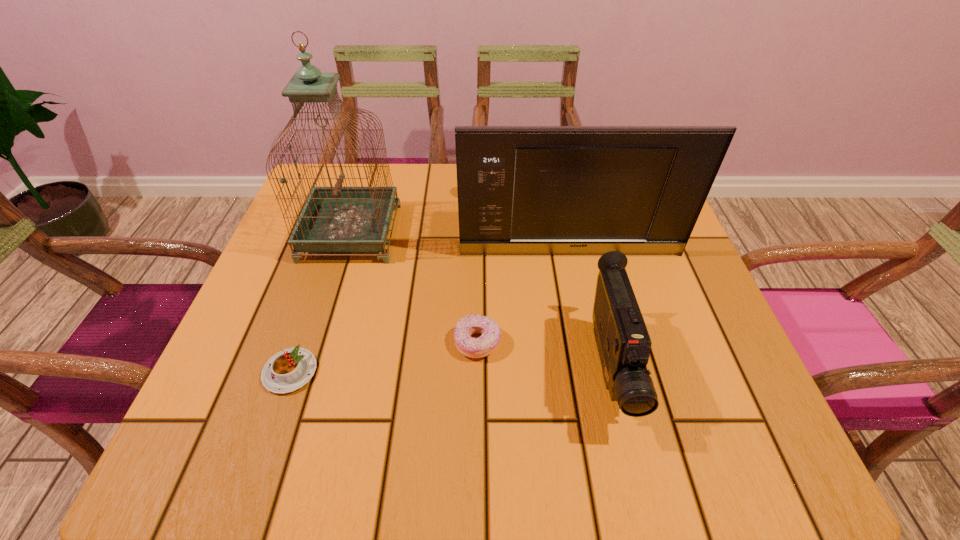
Find the location of a particular element. This screenshot has height=540, width=960. birdcage is located at coordinates (334, 219).

Identify the location of the second tallest object. (542, 190).

Where is `camcorder`? The image size is (960, 540). camcorder is located at coordinates (623, 342).

The image size is (960, 540). Find the location of `the second shortest object`. the second shortest object is located at coordinates (484, 345).

What are the coordinates of `the shortest object` in the screenshot? It's located at (290, 369).

Where is `vacant point located 0.210m at the door of the tallest object`? Image resolution: width=960 pixels, height=540 pixels. vacant point located 0.210m at the door of the tallest object is located at coordinates (485, 233).

The image size is (960, 540). I want to click on free space located 0.260m on the front panel of the second tallest object, so click(591, 355).

Where is `vacant space positioned 0.360m on the left of the fourth tallest object`? The height and width of the screenshot is (540, 960). vacant space positioned 0.360m on the left of the fourth tallest object is located at coordinates pos(261,342).

Locate an element on the screen. This screenshot has width=960, height=540. blank space located on the right of the pudding is located at coordinates (430, 372).

Locate an element on the screen. object that is at the far edge is located at coordinates (334, 219).